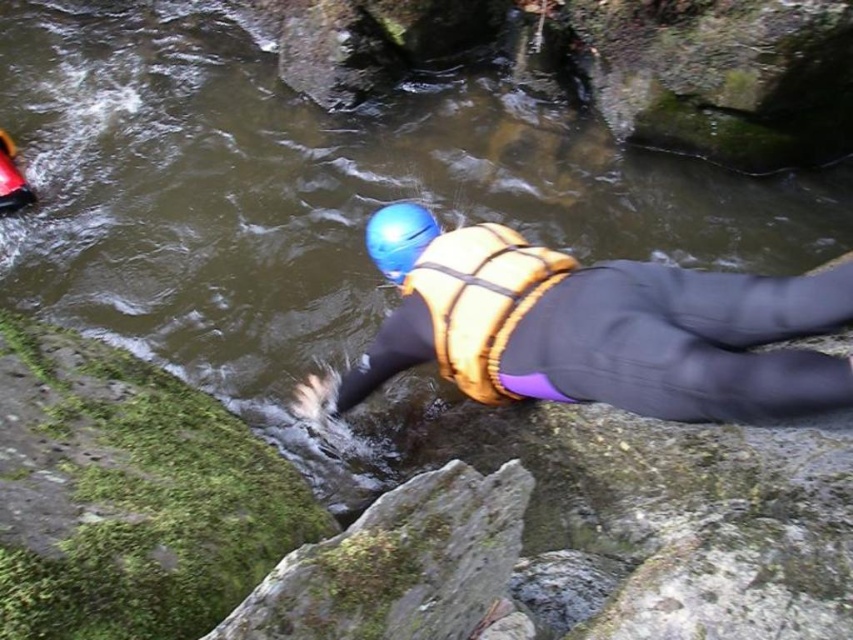
You are a safety inspector assessing the gear of a canyoning participant. You notice the matte yellow life vest at center and the blue matte helmet at center. Which piece of safety equipment is larger in size?

The matte yellow life vest at center is bigger than the blue matte helmet at center.

Looking at this image, you are a safety inspector evaluating the gear of a canyoning participant. The participant has a yellow textured safety vest at center and a blue matte helmet at center. Which piece of gear is wider?

The yellow textured safety vest at center is wider than the blue matte helmet at center.